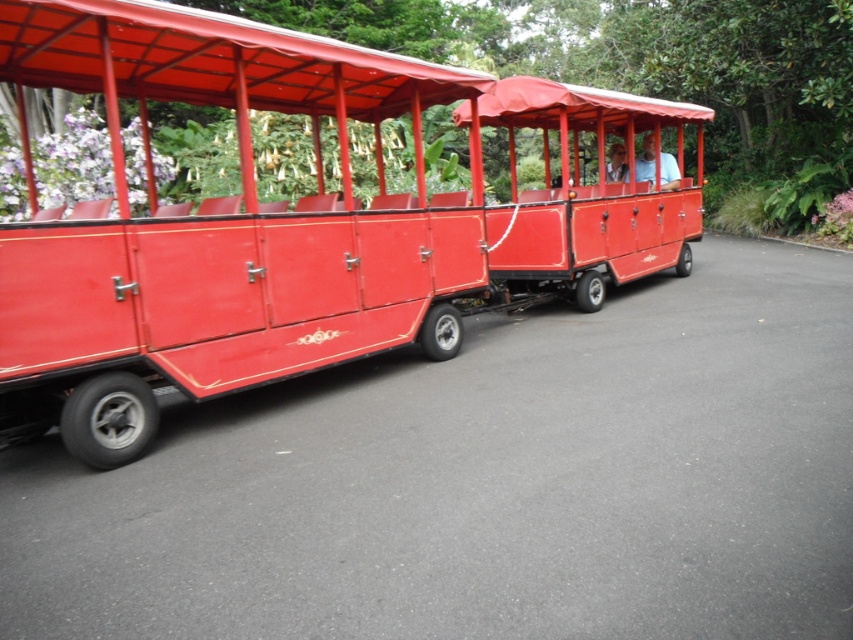
Question: Can you confirm if matte red train car at center is bigger than matte red coach at center?

Choices:
 (A) yes
 (B) no

Answer: (B)

Question: Among these points, which one is farthest from the camera?

Choices:
 (A) (666, 179)
 (B) (242, 259)

Answer: (A)

Question: Which of the following is the closest to the observer?

Choices:
 (A) matte red coach at center
 (B) matte red train car at center

Answer: (A)

Question: Is matte red train car at center above matte red coach at center?

Choices:
 (A) yes
 (B) no

Answer: (A)

Question: From the image, what is the correct spatial relationship of matte red train car at center in relation to matte red coach at center?

Choices:
 (A) below
 (B) above

Answer: (B)

Question: Which point is closer to the camera taking this photo?

Choices:
 (A) (651, 147)
 (B) (421, 156)

Answer: (B)